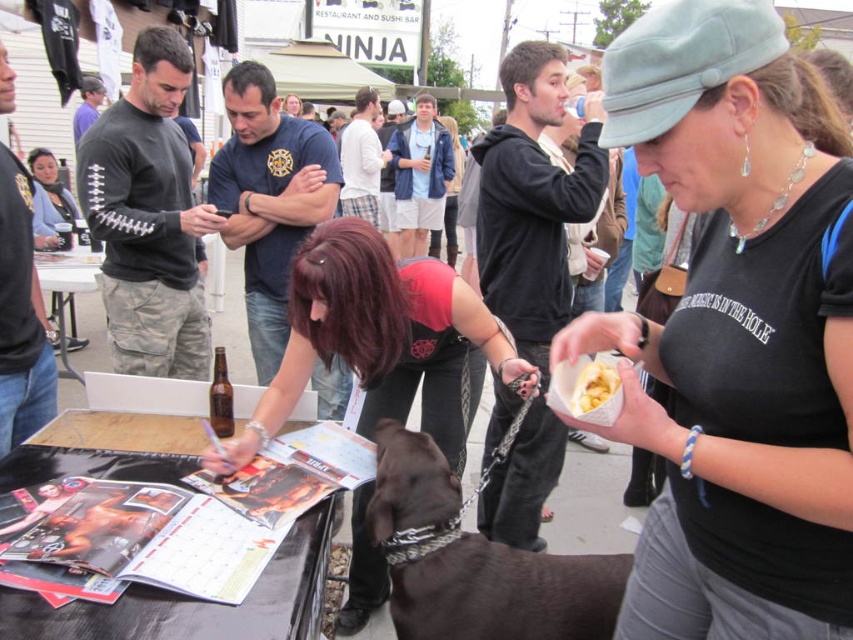
You are a food critic attending the event and notice both the dark brown fur at center and the yellow crumbly food at center on a nearby table. Which item takes up more space horizontally?

The dark brown fur at center has a larger width than the yellow crumbly food at center, so it takes up more horizontal space.

You are at the event and want to take a photo of both the shiny black shirt at center and the dark brown fur at center. Which one should you focus on first if you want to capture both in the same frame without moving your camera?

You should focus on the shiny black shirt at center first because it is to the left of the dark brown fur at center, so by centering your camera on the shiny black shirt at center and then adjusting to include the dark brown fur at center to its right, both can be captured in the same frame without moving the camera.

You are a dog owner at the event and you want to give your dog a treat. The dark brown fur at center is your dog, and the yellow crumbly food at center is the treat. Can your dog reach the treat without moving?

The dark brown fur at center and yellow crumbly food at center are 27.88 inches apart. Since the distance is greater than the typical reach of a dog, your dog cannot reach the treat without moving.